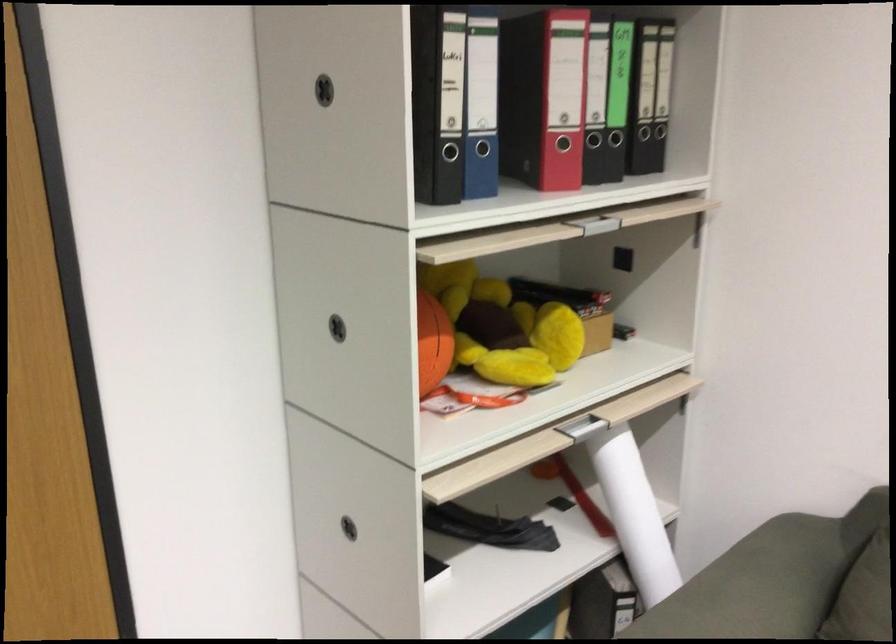
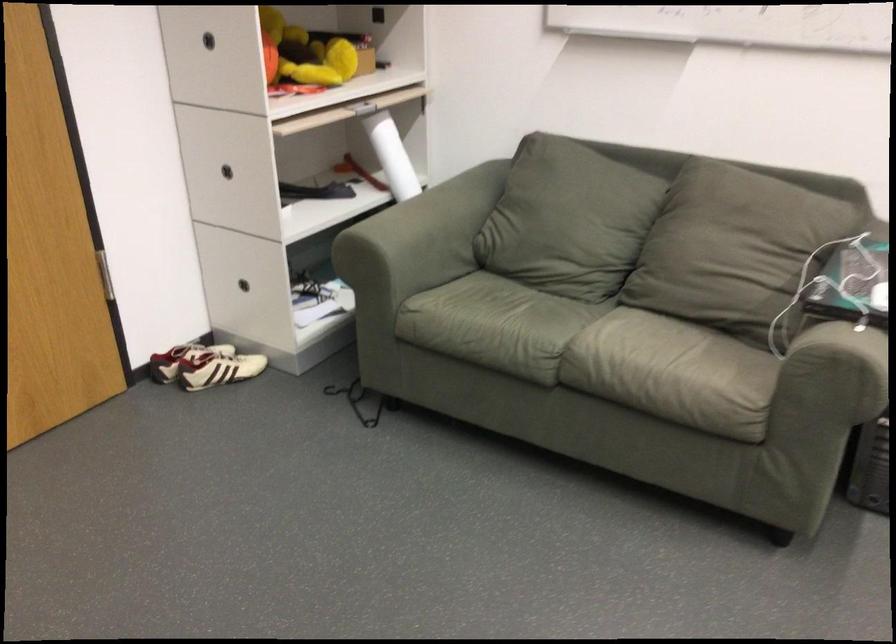
Locate, in the second image, the point that corresponds to (493,315) in the first image.

(303, 53)